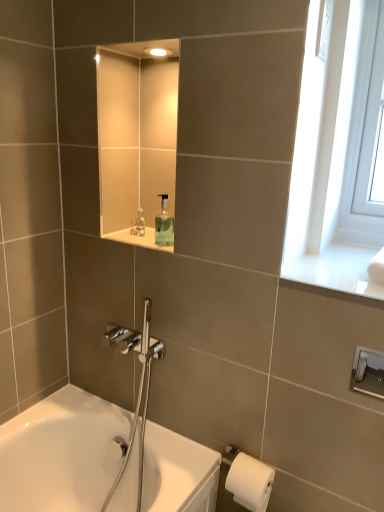
What is the approximate height of translucent plastic soap dispenser at upper center?

10.89 centimeters.

The height and width of the screenshot is (512, 384). What do you see at coordinates (138, 224) in the screenshot?
I see `translucent plastic soap dispenser at upper center` at bounding box center [138, 224].

At what (x,y) coordinates should I click in order to perform the action: click on translucent plastic soap dispenser at upper center. Please return your answer as a coordinate pair (x, y). This screenshot has height=512, width=384. Looking at the image, I should click on (138, 224).

Where is `translucent plastic soap dispenser at upper center`? The height and width of the screenshot is (512, 384). translucent plastic soap dispenser at upper center is located at coordinates (138, 224).